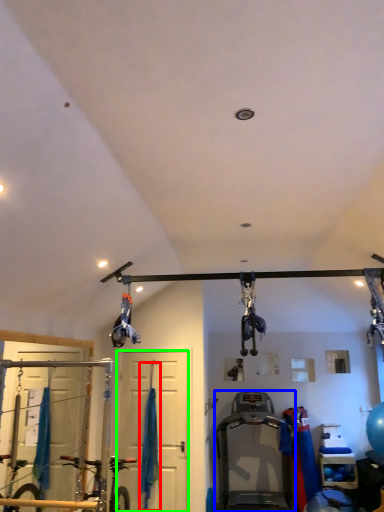
Question: Which is farther away from curtain (highlighted by a red box)? treadmill (highlighted by a blue box) or door (highlighted by a green box)?

Choices:
 (A) treadmill
 (B) door

Answer: (A)